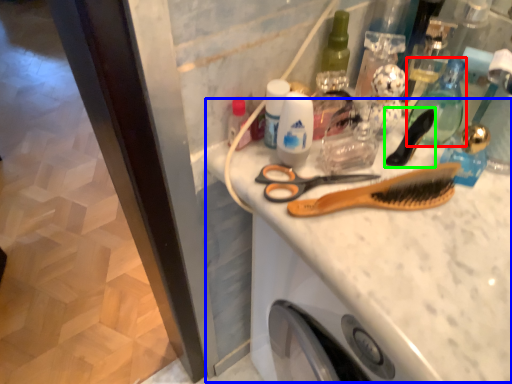
Question: Which object is positioned closest to mouthwash (highlighted by a red box)? Select from counter top (highlighted by a blue box) and brush (highlighted by a green box).

Choices:
 (A) counter top
 (B) brush

Answer: (B)